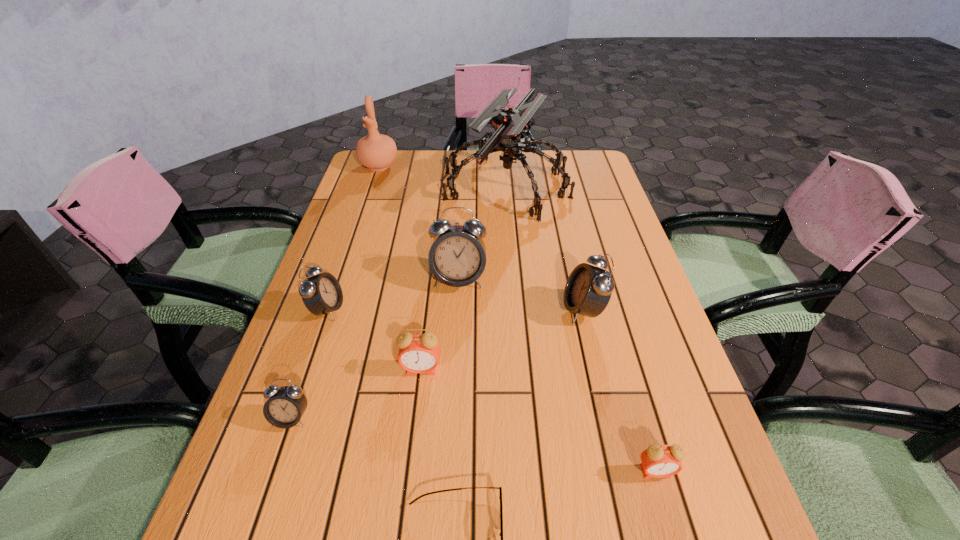
This screenshot has width=960, height=540. I want to click on object that can be found as the third closest to the drone, so click(588, 290).

Point out which alarm clock is positioned as the second nearest to the second smallest white alarm clock. Please provide its 2D coordinates. Your answer should be formatted as a tuple, i.e. [(x, y)], where the tuple contains the x and y coordinates of a point satisfying the conditions above.

[(457, 257)]

Where is `the fourth closest alarm clock to the shortest object`? This screenshot has width=960, height=540. the fourth closest alarm clock to the shortest object is located at coordinates (588, 290).

Select which white alarm clock appears as the closest to the seventh farthest object. Please provide its 2D coordinates. Your answer should be formatted as a tuple, i.e. [(x, y)], where the tuple contains the x and y coordinates of a point satisfying the conditions above.

[(321, 294)]

Identify which white alarm clock is the second closest to the smaller pink alarm clock. Please provide its 2D coordinates. Your answer should be formatted as a tuple, i.e. [(x, y)], where the tuple contains the x and y coordinates of a point satisfying the conditions above.

[(457, 257)]

At what (x,y) coordinates should I click in order to perform the action: click on free space that satisfies the following two spatial constraints: 1. on the face of the fourth tallest object; 2. on the face of the third nearest object. Please return your answer as a coordinate pair (x, y). The width and height of the screenshot is (960, 540). Looking at the image, I should click on (609, 418).

Locate an element on the screen. This screenshot has width=960, height=540. vacant region that satisfies the following two spatial constraints: 1. on the face of the rightmost white alarm clock; 2. on the face of the smallest white alarm clock is located at coordinates (609, 418).